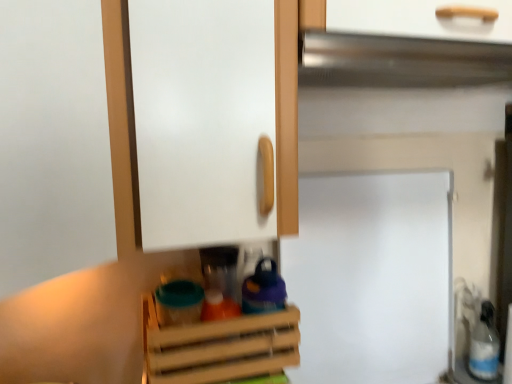
Question: Can you confirm if white plastic bottle at lower right is wider than white matte fridge at center?

Choices:
 (A) no
 (B) yes

Answer: (B)

Question: Are white plastic bottle at lower right and white matte fridge at center located far from each other?

Choices:
 (A) no
 (B) yes

Answer: (A)

Question: From the image's perspective, is white plastic bottle at lower right above white matte fridge at center?

Choices:
 (A) yes
 (B) no

Answer: (B)

Question: Is white plastic bottle at lower right shorter than white matte fridge at center?

Choices:
 (A) yes
 (B) no

Answer: (A)

Question: Does white plastic bottle at lower right have a greater height compared to white matte fridge at center?

Choices:
 (A) yes
 (B) no

Answer: (B)

Question: Is white plastic bottle at lower right not within white matte fridge at center?

Choices:
 (A) yes
 (B) no

Answer: (A)

Question: From a real-world perspective, does white matte fridge at center sit lower than silver metallic exhaust hood at upper center?

Choices:
 (A) yes
 (B) no

Answer: (A)

Question: Is white matte fridge at center positioned behind silver metallic exhaust hood at upper center?

Choices:
 (A) no
 (B) yes

Answer: (B)

Question: Considering the relative sizes of white matte fridge at center and silver metallic exhaust hood at upper center in the image provided, is white matte fridge at center shorter than silver metallic exhaust hood at upper center?

Choices:
 (A) no
 (B) yes

Answer: (A)

Question: Is white matte fridge at center wider than silver metallic exhaust hood at upper center?

Choices:
 (A) no
 (B) yes

Answer: (A)

Question: Considering the relative sizes of white matte fridge at center and silver metallic exhaust hood at upper center in the image provided, is white matte fridge at center smaller than silver metallic exhaust hood at upper center?

Choices:
 (A) no
 (B) yes

Answer: (A)

Question: Is the depth of white matte fridge at center less than that of silver metallic exhaust hood at upper center?

Choices:
 (A) no
 (B) yes

Answer: (A)

Question: Considering the relative positions of silver metallic exhaust hood at upper center and white plastic bottle at lower right in the image provided, is silver metallic exhaust hood at upper center behind white plastic bottle at lower right?

Choices:
 (A) yes
 (B) no

Answer: (B)